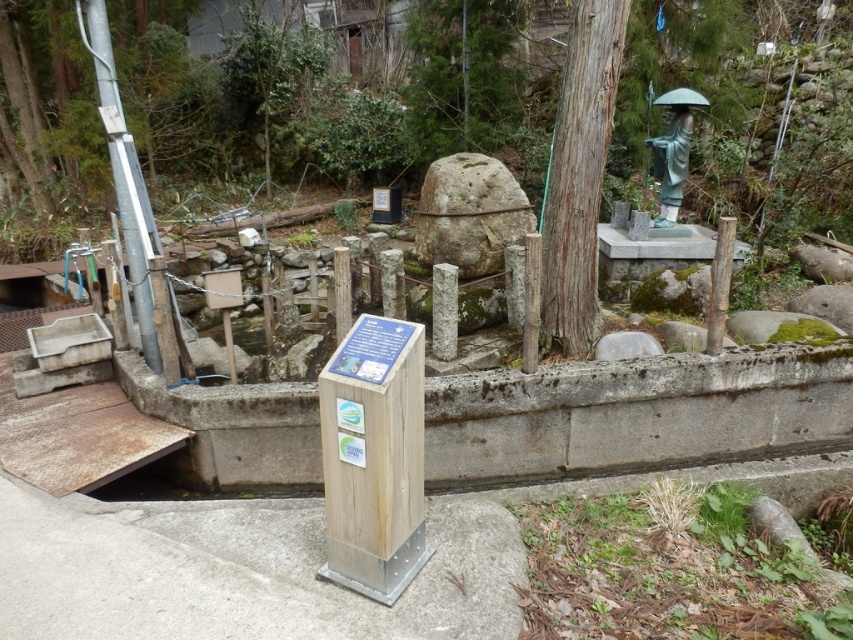
You are standing in the park and want to take a photo of both the brown rough textured tree at upper right and the green patina statue at upper right. Which object should you focus on first to ensure both are in the frame?

You should focus on the brown rough textured tree at upper right first because it is closer to the viewer than the green patina statue at upper right, ensuring both are in the frame.

You are a visitor standing in the park and want to take a photo of both the green mossy rock at upper center and the green patina statue at upper right. Which object should you focus on first to ensure both are in the frame?

You should focus on the green mossy rock at upper center first because it is closer to you than the green patina statue at upper right, so adjusting the camera to include both would require ensuring the closer object is framed properly first.